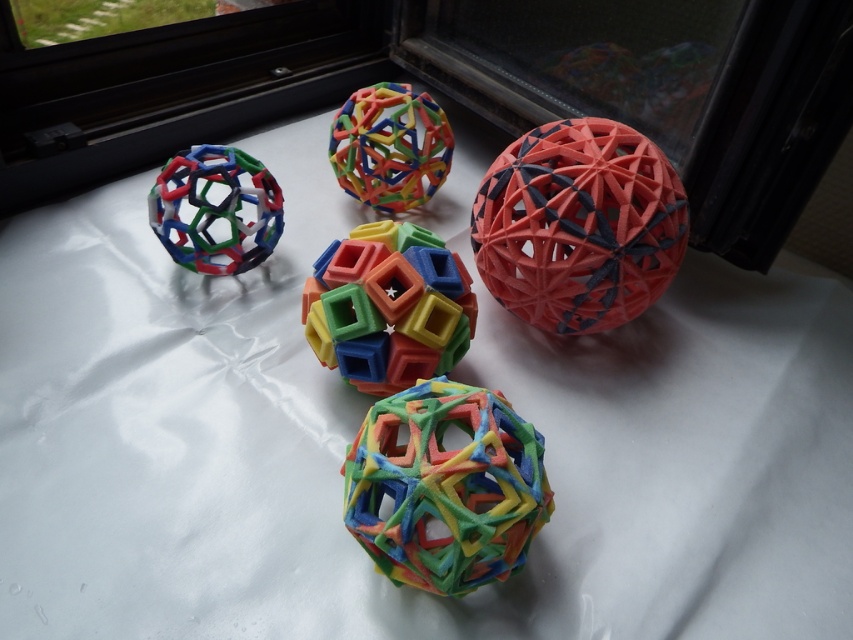
You are an artist planning to paint a still life of the multicolored rubber ball at center and the multicolored plastic ball at center. Which of the two balls is positioned lower in the image?

The multicolored rubber ball at center is positioned lower than the multicolored plastic ball at center.

You are standing 1.5 meters away from the multicolored plastic ball at left. Can you reach it without moving your feet?

The multicolored plastic ball at left is 1.20 meters from the camera. Since you are standing 1.5 meters away from it, you can reach it without moving your feet.

You are looking at an image of five 3D printed spheres on a white surface. You see a point at coordinates (387,307). Which object does this point correspond to?

The point at coordinates (387,307) corresponds to the multicolored plastic cube at center.